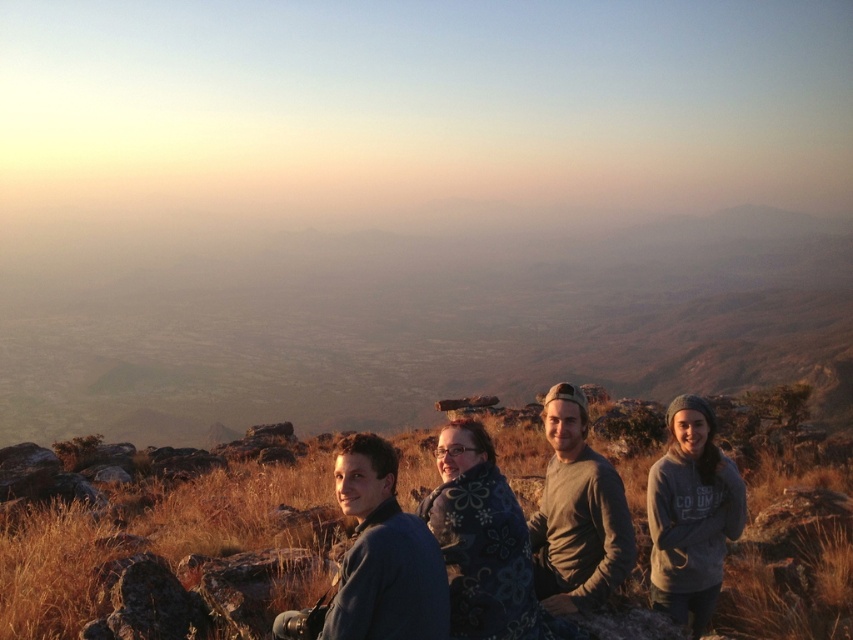
Question: Which object is positioned farthest from the floral-patterned blanket at center?

Choices:
 (A) green cotton shirt at center
 (B) gray fleece jacket at lower right

Answer: (B)

Question: Does floral-patterned blanket at center lie behind gray fleece jacket at lower right?

Choices:
 (A) no
 (B) yes

Answer: (A)

Question: Does floral-patterned blanket at center have a smaller size compared to green cotton shirt at center?

Choices:
 (A) no
 (B) yes

Answer: (A)

Question: Which point is closer to the camera taking this photo?

Choices:
 (A) (447, 461)
 (B) (550, 577)
 (C) (666, 540)

Answer: (A)

Question: Is floral-patterned blanket at center to the left of gray fleece jacket at lower right from the viewer's perspective?

Choices:
 (A) yes
 (B) no

Answer: (A)

Question: Which of the following is the farthest from the observer?

Choices:
 (A) (567, 460)
 (B) (508, 506)
 (C) (706, 512)

Answer: (A)